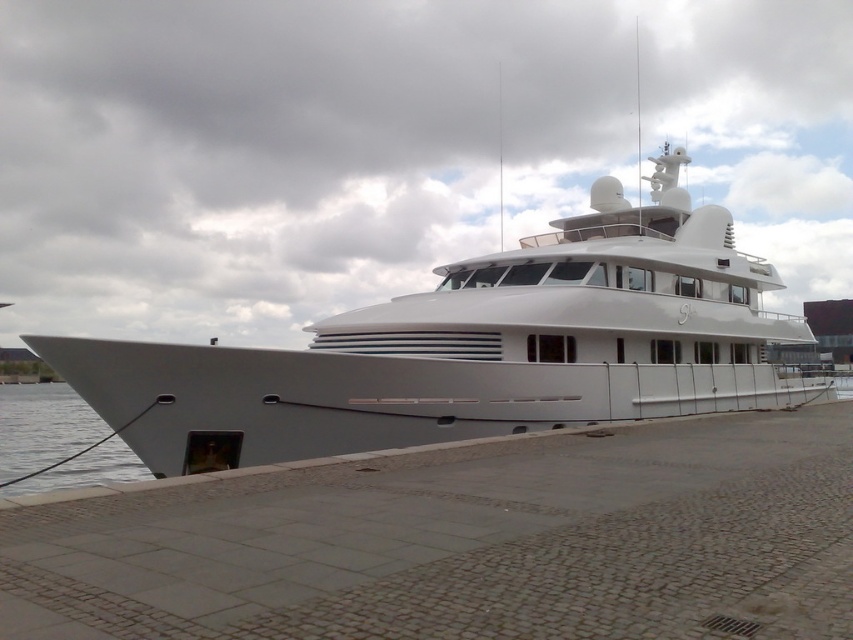
Question: Is white glossy yacht at center closer to camera compared to clear water at lower left?

Choices:
 (A) no
 (B) yes

Answer: (B)

Question: Does white glossy yacht at center come behind clear water at lower left?

Choices:
 (A) yes
 (B) no

Answer: (B)

Question: Which point appears farthest from the camera in this image?

Choices:
 (A) (520, 337)
 (B) (74, 456)

Answer: (B)

Question: Does white glossy yacht at center have a larger size compared to clear water at lower left?

Choices:
 (A) yes
 (B) no

Answer: (A)